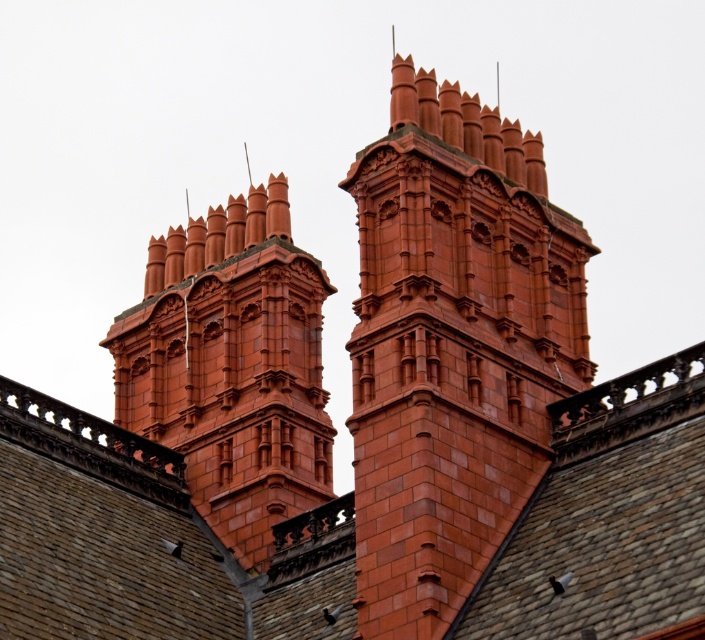
You are an architect examining the image. You need to determine which structure is nearer to the camera between the matte brick tower at center and the matte brick chimney at upper center. Based on the spatial arrangement, which one is closer?

The matte brick tower at center is closer to the viewer than the matte brick chimney at upper center.

Based on the scene description, where is the smooth slate roof at center located in terms of its 2D coordinates?

The smooth slate roof at center is located at the 2D coordinates of point (145, 541).

You are an architect analyzing the image. The smooth slate roof at center is part of the building. Based on its coordinates, is it positioned closer to the top or bottom of the image?

The smooth slate roof at center is located at point coordinates with a y value of 0.206, which places it closer to the bottom of the image since lower y values indicate positions nearer the bottom.